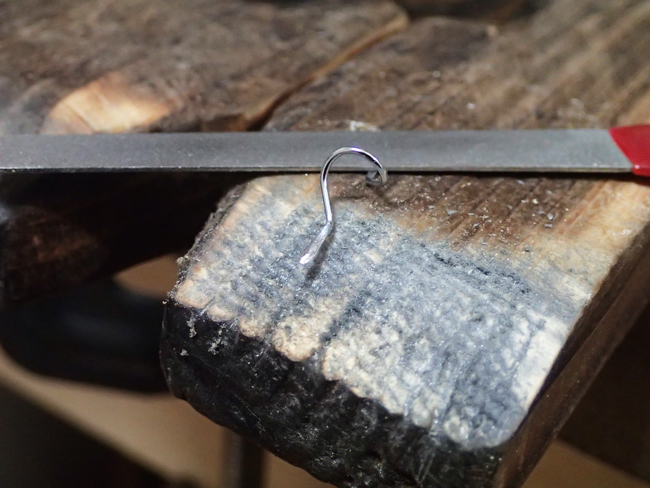
Identify the location of hook. The width and height of the screenshot is (650, 488). (324, 184).